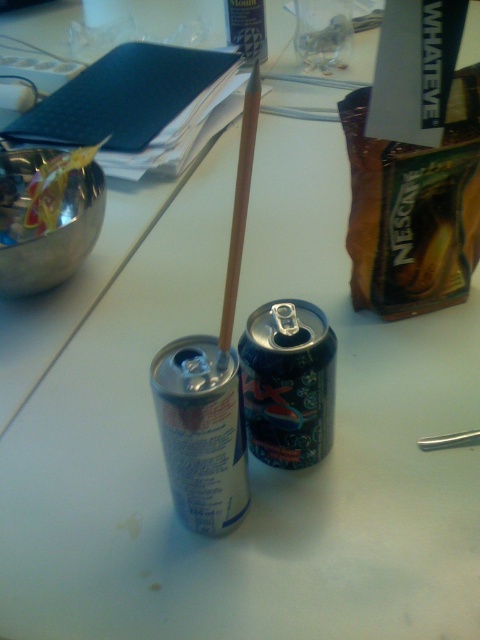
Based on the photo, is shiny metallic can at center closer to the viewer compared to wooden straw at center?

No.

Is point (326, 444) closer to camera compared to point (241, 243)?

No.

Is point (267, 380) farther from viewer compared to point (247, 177)?

Yes, it is behind point (247, 177).

Where is `shiny metallic can at center`? The height and width of the screenshot is (640, 480). shiny metallic can at center is located at coordinates (288, 381).

Is silver metallic red bull can at center to the right of shiny metallic can at center from the viewer's perspective?

No, silver metallic red bull can at center is not to the right of shiny metallic can at center.

This screenshot has width=480, height=640. What do you see at coordinates (202, 432) in the screenshot? I see `silver metallic red bull can at center` at bounding box center [202, 432].

Image resolution: width=480 pixels, height=640 pixels. I want to click on silver metallic red bull can at center, so point(202,432).

Can you confirm if silver metallic red bull can at center is positioned below wooden straw at center?

Correct, silver metallic red bull can at center is located below wooden straw at center.

Is silver metallic red bull can at center further to camera compared to wooden straw at center?

Yes, silver metallic red bull can at center is behind wooden straw at center.

Which is behind, point (211, 497) or point (219, 348)?

The point (211, 497) is behind.

Where is `silver metallic red bull can at center`? This screenshot has width=480, height=640. silver metallic red bull can at center is located at coordinates (202, 432).